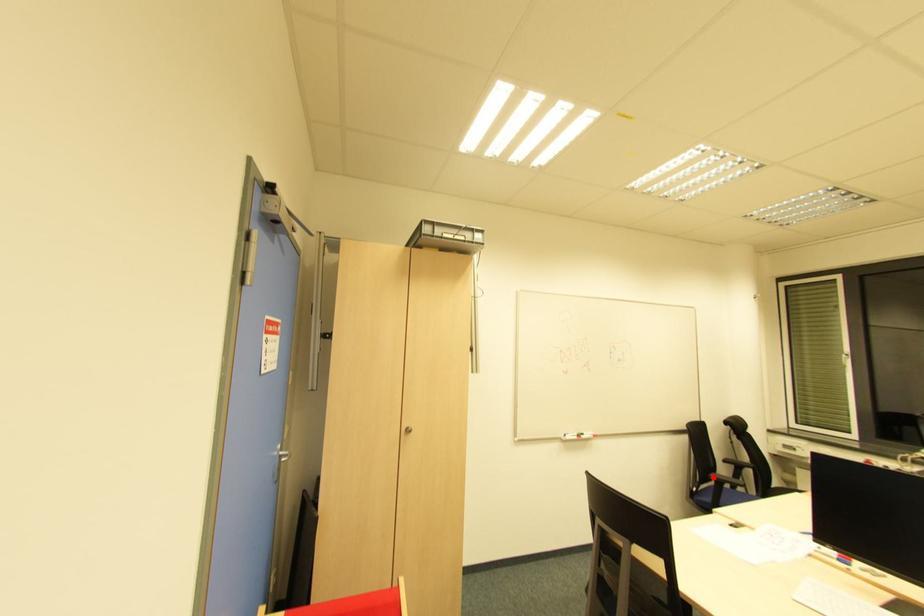
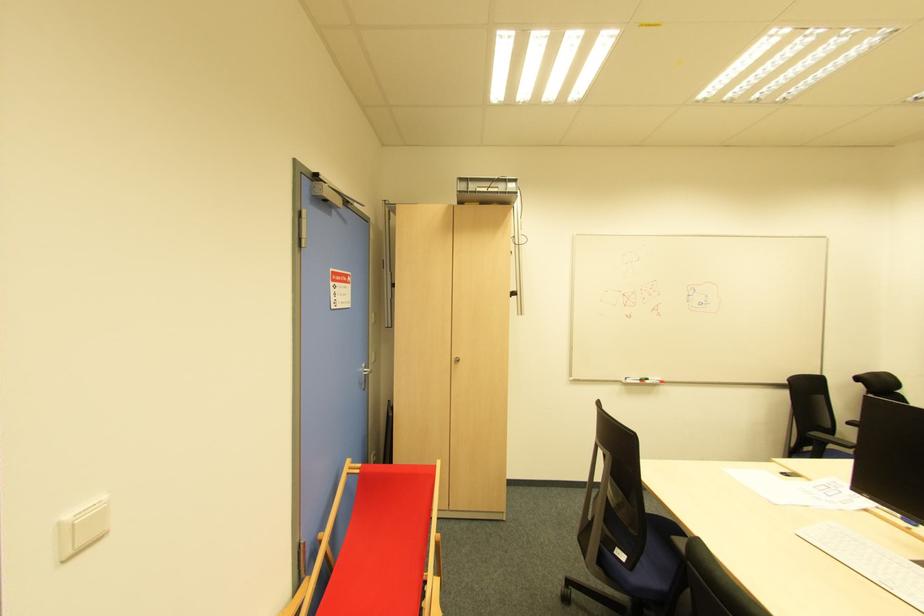
Question: I am providing you with two images of the same scene from different viewpoints. A red point is marked on the first image. Can you still see the location of the red point in image 2?

Choices:
 (A) Yes
 (B) No

Answer: (A)